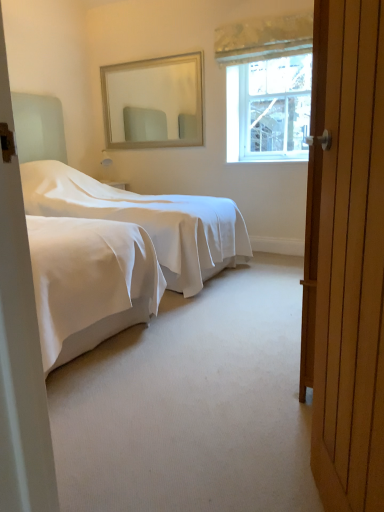
Question: From a real-world perspective, is wooden door at right on top of clear glass window at upper right?

Choices:
 (A) yes
 (B) no

Answer: (B)

Question: Is wooden door at right behind clear glass window at upper right?

Choices:
 (A) yes
 (B) no

Answer: (B)

Question: From the image's perspective, is wooden door at right under clear glass window at upper right?

Choices:
 (A) yes
 (B) no

Answer: (A)

Question: Can you confirm if wooden door at right is shorter than clear glass window at upper right?

Choices:
 (A) no
 (B) yes

Answer: (A)

Question: Is wooden door at right in front of clear glass window at upper right?

Choices:
 (A) no
 (B) yes

Answer: (B)

Question: Looking at their shapes, would you say white smooth bed at center is wider or thinner than clear glass window at upper right?

Choices:
 (A) wide
 (B) thin

Answer: (A)

Question: From a real-world perspective, is white smooth bed at center above or below clear glass window at upper right?

Choices:
 (A) below
 (B) above

Answer: (A)

Question: In the image, is white smooth bed at center positioned in front of or behind clear glass window at upper right?

Choices:
 (A) behind
 (B) front

Answer: (B)

Question: From the image's perspective, relative to clear glass window at upper right, is white smooth bed at center above or below?

Choices:
 (A) above
 (B) below

Answer: (B)

Question: Is clear glass window at upper right bigger or smaller than textured cream curtain at upper center?

Choices:
 (A) small
 (B) big

Answer: (B)

Question: In the image, is clear glass window at upper right positioned in front of or behind textured cream curtain at upper center?

Choices:
 (A) front
 (B) behind

Answer: (B)

Question: From a real-world perspective, is clear glass window at upper right positioned above or below textured cream curtain at upper center?

Choices:
 (A) below
 (B) above

Answer: (A)

Question: From the image's perspective, relative to textured cream curtain at upper center, is clear glass window at upper right above or below?

Choices:
 (A) below
 (B) above

Answer: (A)

Question: From the image's perspective, is wooden door at right above or below textured cream curtain at upper center?

Choices:
 (A) below
 (B) above

Answer: (A)

Question: Is wooden door at right in front of or behind textured cream curtain at upper center in the image?

Choices:
 (A) front
 (B) behind

Answer: (A)